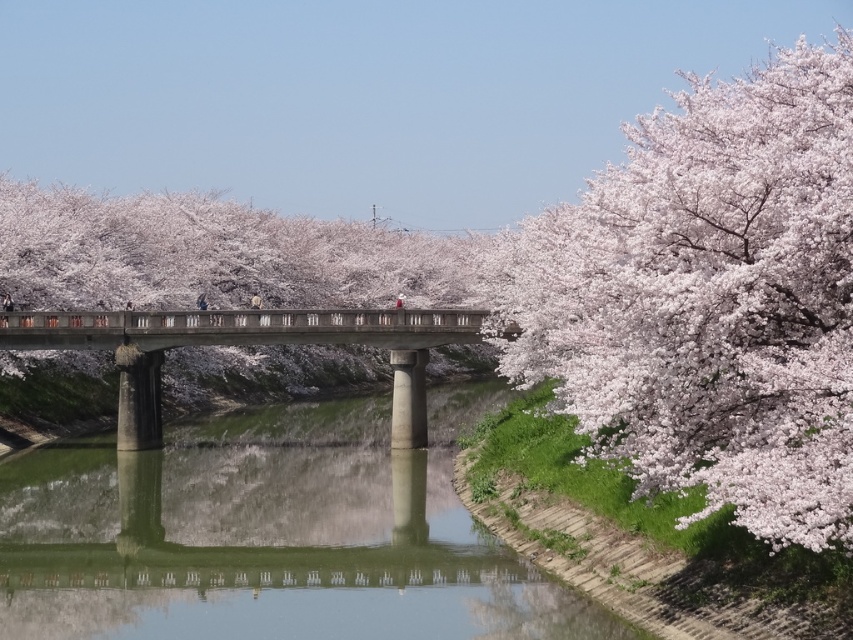
Is point (706, 492) closer to camera compared to point (242, 323)?

Yes, point (706, 492) is in front of point (242, 323).

Can you confirm if pink blossoms at right is thinner than concrete bridge at center?

No.

What do you see at coordinates (709, 300) in the screenshot? I see `pink blossoms at right` at bounding box center [709, 300].

Find the location of a particular element. pink blossoms at right is located at coordinates (709, 300).

Is pink blossoms at right closer to camera compared to green concrete river at center?

Yes, pink blossoms at right is closer to the viewer.

The image size is (853, 640). I want to click on pink blossoms at right, so click(709, 300).

Which is behind, point (680, 228) or point (316, 620)?

The point (316, 620) is behind.

I want to click on pink blossoms at right, so click(x=709, y=300).

Which is more to the right, green concrete river at center or concrete bridge at center?

green concrete river at center

Which of these two, green concrete river at center or concrete bridge at center, stands taller?

Standing taller between the two is concrete bridge at center.

You are a GUI agent. You are given a task and a screenshot of the screen. Output one action in this format:
    pyautogui.click(x=<x>, y=<y>)
    Task: Click on the green concrete river at center
    Image resolution: width=853 pixels, height=640 pixels.
    Given the screenshot: What is the action you would take?
    pyautogui.click(x=265, y=550)

Where is `green concrete river at center`? The height and width of the screenshot is (640, 853). green concrete river at center is located at coordinates (265, 550).